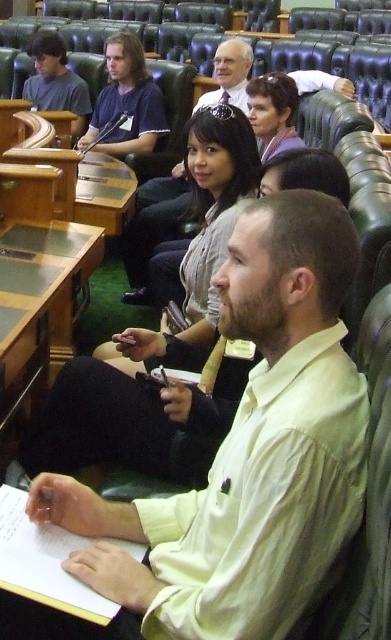
Question: Considering the relative positions of light yellow shirt at center and matte black shirt at upper left in the image provided, where is light yellow shirt at center located with respect to matte black shirt at upper left?

Choices:
 (A) above
 (B) below

Answer: (B)

Question: Among these objects, which one is nearest to the camera?

Choices:
 (A) light yellow shirt at center
 (B) matte black shirt at upper left
 (C) light beige shirt at center

Answer: (A)

Question: In this image, where is light yellow shirt at center located relative to matte black shirt at upper left?

Choices:
 (A) left
 (B) right

Answer: (B)

Question: Where is light yellow shirt at center located in relation to matte black shirt at center in the image?

Choices:
 (A) below
 (B) above

Answer: (A)

Question: Which is nearer to the matte black shirt at center?

Choices:
 (A) matte black shirt at upper left
 (B) light yellow shirt at center
 (C) light beige shirt at center

Answer: (A)

Question: Which of the following is the closest to the observer?

Choices:
 (A) (96, 134)
 (B) (299, 77)
 (C) (46, 497)
 (D) (87, 108)

Answer: (C)